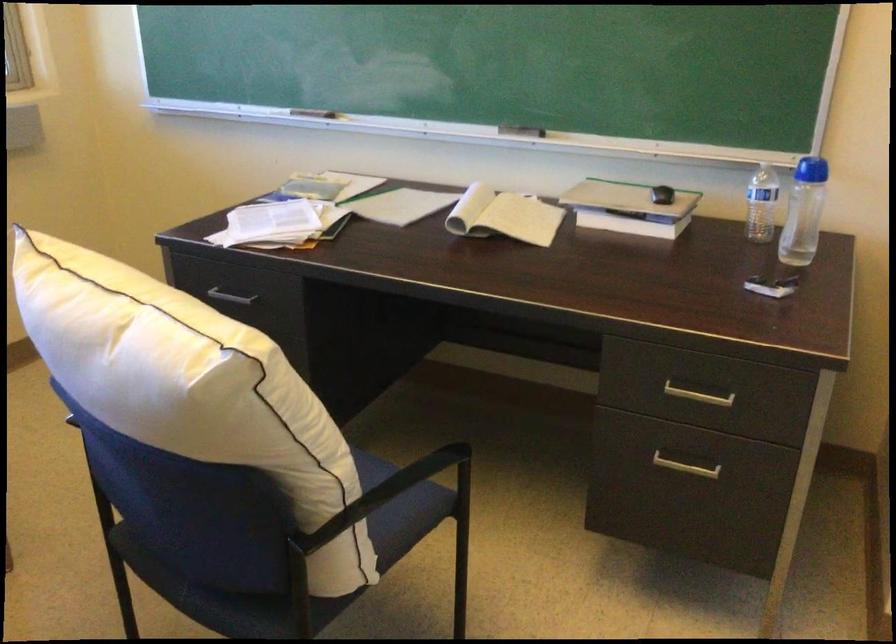
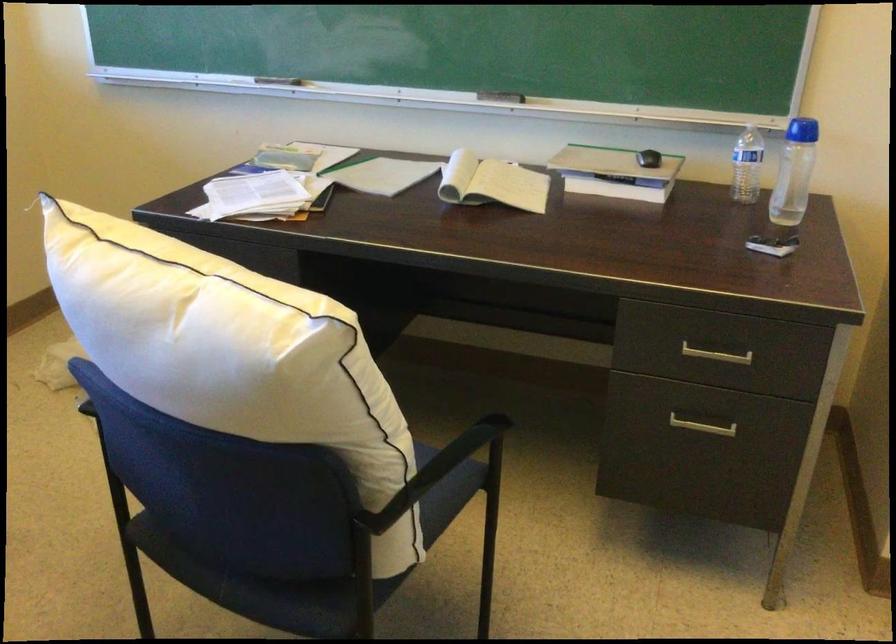
Question: Which direction would the cameraman need to move to produce the second image? Reply with the corresponding letter.

Choices:
 (A) Left
 (B) Right
 (C) Forward
 (D) Backward

Answer: (A)